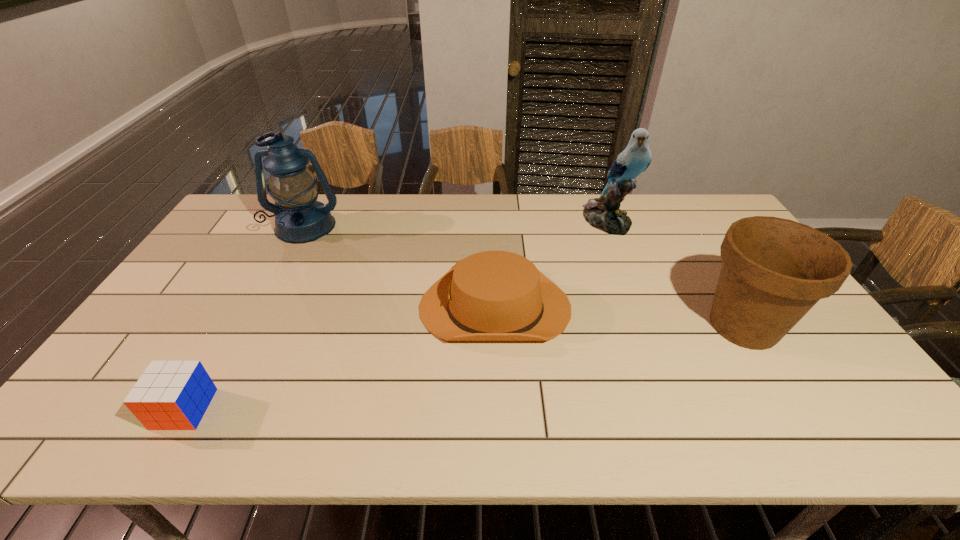
You are a GUI agent. You are given a task and a screenshot of the screen. Output one action in this format:
    pyautogui.click(x=<x>, y=<y>)
    Task: Click on the fourth object from left to right
    The width and height of the screenshot is (960, 540).
    Given the screenshot: What is the action you would take?
    click(x=603, y=213)

The height and width of the screenshot is (540, 960). In order to click on lantern in this screenshot , I will do `click(299, 218)`.

Locate an element on the screen. The height and width of the screenshot is (540, 960). the third tallest object is located at coordinates (774, 270).

You are a GUI agent. You are given a task and a screenshot of the screen. Output one action in this format:
    pyautogui.click(x=<x>, y=<y>)
    Task: Click on the flowerpot
    
    Given the screenshot: What is the action you would take?
    pyautogui.click(x=774, y=270)

The height and width of the screenshot is (540, 960). I want to click on cowboy hat, so click(493, 295).

This screenshot has height=540, width=960. In order to click on the nearest object in this screenshot , I will do `click(170, 395)`.

In order to click on free spot located on the face of the parakeet in this screenshot , I will do `click(622, 258)`.

Where is `vacant region located 0.140m on the face of the lantern`? The height and width of the screenshot is (540, 960). vacant region located 0.140m on the face of the lantern is located at coordinates (282, 271).

The height and width of the screenshot is (540, 960). What are the coordinates of `vacant region located on the back of the flowerpot` in the screenshot? It's located at 695,246.

Identify the location of vacant space located 0.130m on the front-facing side of the third object from left to right. Image resolution: width=960 pixels, height=540 pixels. (373, 307).